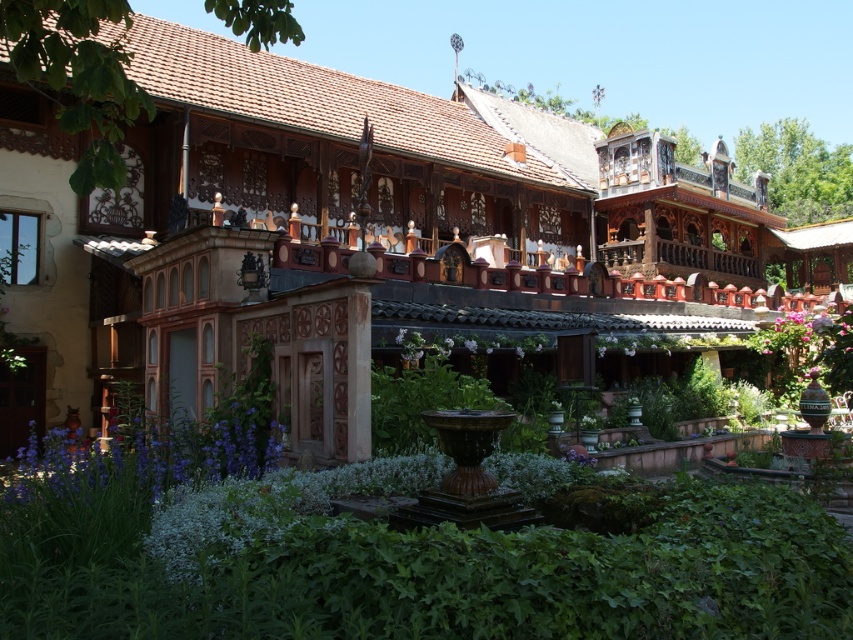
Is wooden balcony at center bigger than purple matte flower at center?

Yes.

Does wooden balcony at center have a smaller size compared to purple matte flower at center?

Actually, wooden balcony at center might be larger than purple matte flower at center.

At what (x,y) coordinates should I click in order to perform the action: click on wooden balcony at center. Please return your answer as a coordinate pair (x, y). Looking at the image, I should click on (381, 230).